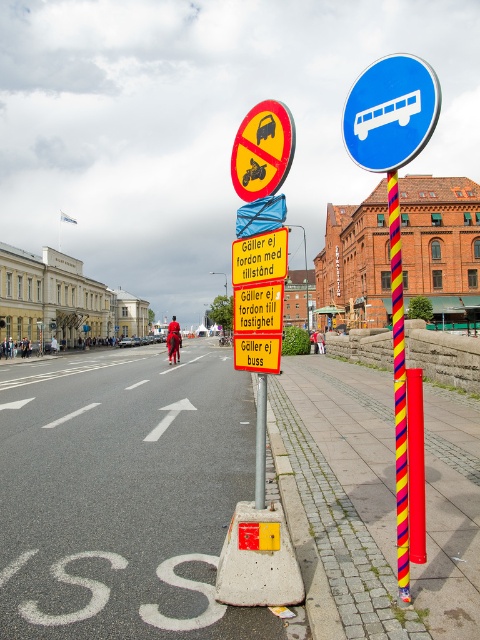
You are a delivery driver who needs to park your van near the blue plastic bus at upper center. The parking spot you want is 5 meters away from the multicolored striped pole at center. Can you park there?

The blue plastic bus at upper center is 4.74 meters from the multicolored striped pole at center. Since the parking spot is 5 meters away from the pole, it is slightly farther than the bus. Therefore, the parking spot is available for parking.

You are a delivery person trying to park your delivery van on the paved concrete sidewalk at lower center. The blue plastic bus at upper center is parked nearby. Can you park your van there without overlapping the bus?

The paved concrete sidewalk at lower center might be wider than blue plastic bus at upper center, so there is a possibility that the van can park without overlapping the bus, but it depends on the exact width difference.

You are a delivery driver who needs to park your vehicle temporarily. You see a blue plastic bus at upper center near the signpost. According to the traffic signs, can you park your vehicle here?

The blue plastic bus at upper center is located at point [391,113], which is near the traffic signs indicating restrictions for vehicles without permission and buses. Since the signs state no entry for buses and vehicles without permission, you cannot park your vehicle here unless you have permission.